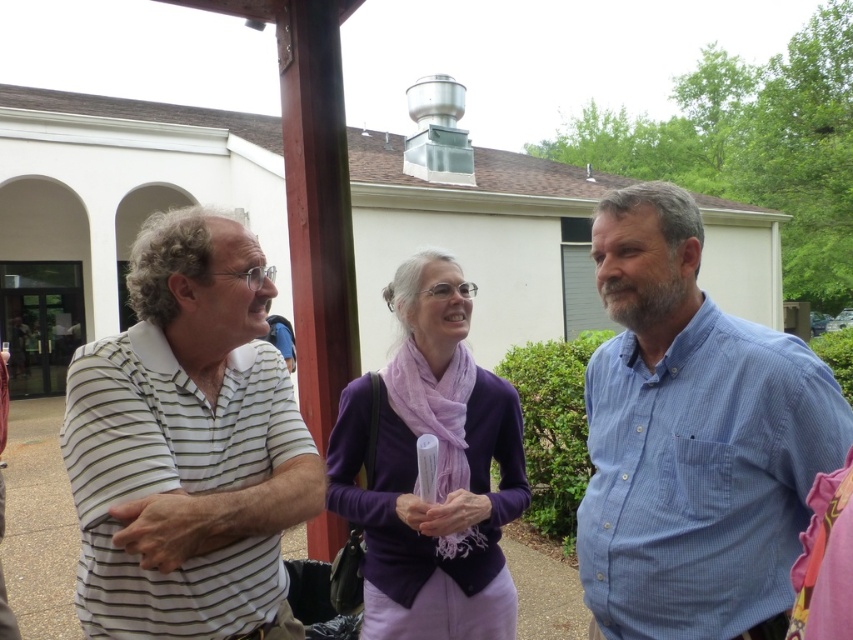
Can you confirm if blue striped shirt at right is positioned below white striped polo shirt at left?

Yes, blue striped shirt at right is below white striped polo shirt at left.

Based on the photo, who is more distant from viewer, (631, 522) or (91, 365)?

The point (631, 522) is more distant.

Where is `blue striped shirt at right`? blue striped shirt at right is located at coordinates (692, 440).

The height and width of the screenshot is (640, 853). I want to click on white striped shirt at left, so click(x=692, y=438).

The width and height of the screenshot is (853, 640). Find the location of `white striped shirt at left`. white striped shirt at left is located at coordinates (692, 438).

Is white striped shirt at left closer to the viewer compared to white striped polo shirt at left?

No, it is not.

Is point (624, 454) positioned behind point (253, 305)?

Yes.

What do you see at coordinates (692, 438) in the screenshot? This screenshot has height=640, width=853. I see `white striped shirt at left` at bounding box center [692, 438].

This screenshot has width=853, height=640. In order to click on white striped shirt at left in this screenshot , I will do `click(692, 438)`.